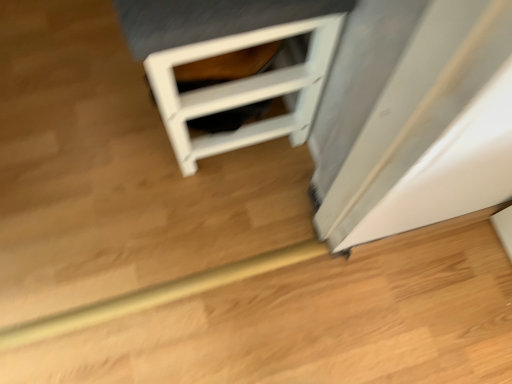
This screenshot has height=384, width=512. What are the coordinates of `white matte shelf at center` in the screenshot? It's located at (227, 52).

The height and width of the screenshot is (384, 512). Describe the element at coordinates (227, 52) in the screenshot. I see `white matte shelf at center` at that location.

Identify the location of white matte shelf at center. (227, 52).